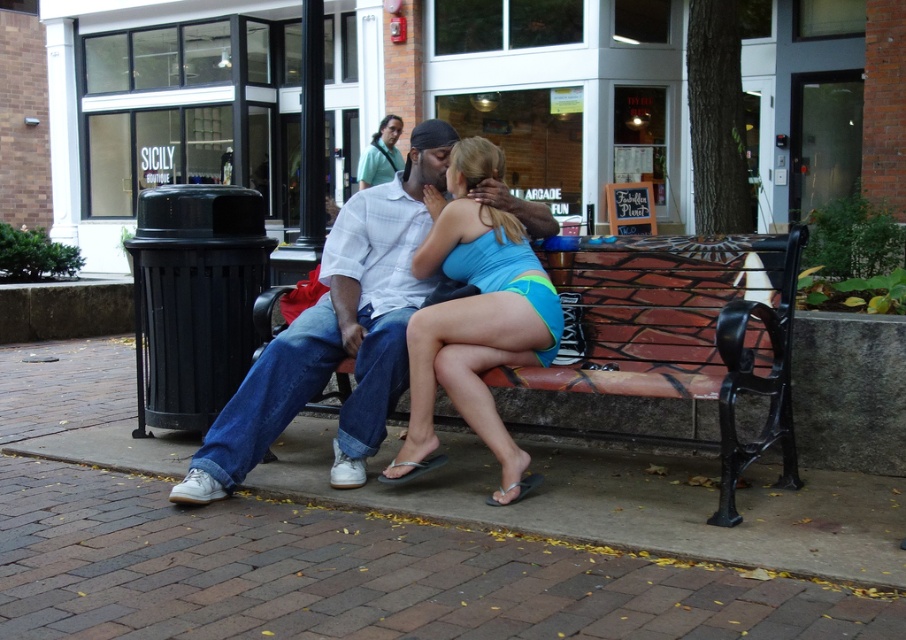
Who is lower down, brick-patterned bench at center or white cotton shirt at center?

brick-patterned bench at center is below.

Which is more to the right, brick-patterned bench at center or white cotton shirt at center?

Positioned to the right is brick-patterned bench at center.

Does point (560, 241) come farther from viewer compared to point (215, 481)?

Yes, it is behind point (215, 481).

This screenshot has width=906, height=640. I want to click on brick-patterned bench at center, so click(680, 336).

Is white cotton shirt at center smaller than blue fabric shorts at center?

No, white cotton shirt at center is not smaller than blue fabric shorts at center.

Who is lower down, white cotton shirt at center or blue fabric shorts at center?

white cotton shirt at center is below.

Between point (239, 422) and point (412, 435), which one is positioned behind?

The point (239, 422) is more distant.

At what (x,y) coordinates should I click in order to perform the action: click on white cotton shirt at center. Please return your answer as a coordinate pair (x, y). The width and height of the screenshot is (906, 640). Looking at the image, I should click on (336, 333).

Is brick-patterned bench at center wider than blue fabric shorts at center?

Yes, brick-patterned bench at center is wider than blue fabric shorts at center.

Between point (583, 355) and point (541, 340), which one is positioned in front?

Point (541, 340)

Locate an element on the screen. brick-patterned bench at center is located at coordinates (680, 336).